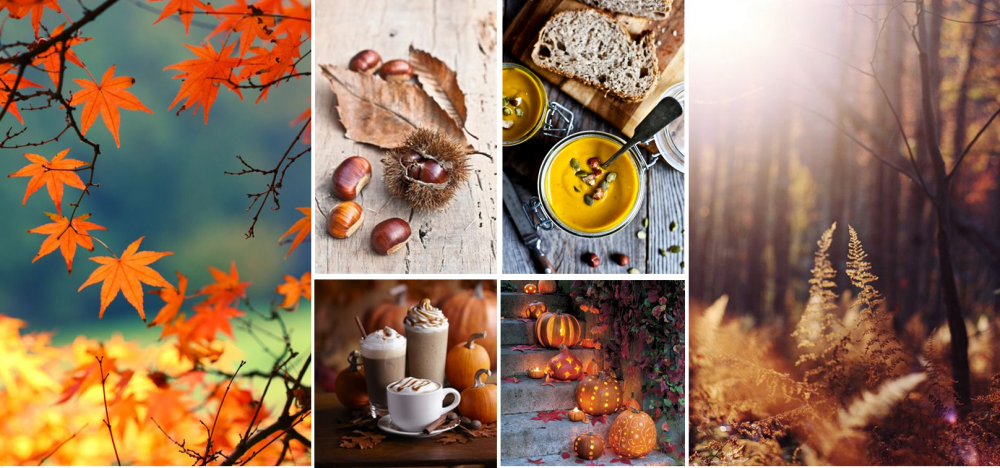
Find the location of a particular element. This screenshot has width=1000, height=468. photos is located at coordinates (112, 313), (451, 223), (575, 206), (421, 368), (581, 368), (796, 238).